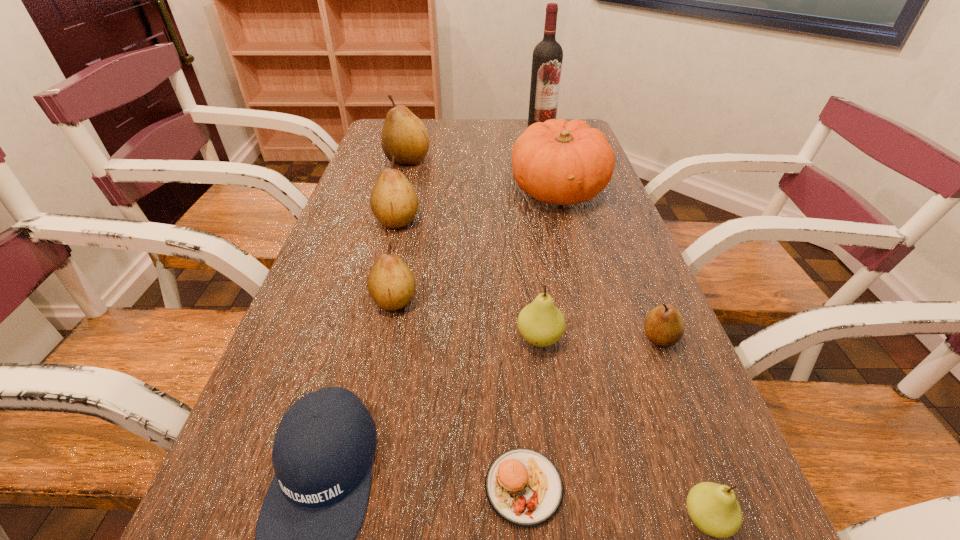
You are a GUI agent. You are given a task and a screenshot of the screen. Output one action in this format:
    pyautogui.click(x=<x>, y=<y>)
    Task: Click on the wine bottle
    
    Given the screenshot: What is the action you would take?
    pyautogui.click(x=547, y=58)

The image size is (960, 540). What are the coordinates of `the farthest object` in the screenshot? It's located at (547, 58).

Where is `the farthest pear`? This screenshot has width=960, height=540. the farthest pear is located at coordinates (403, 135).

Image resolution: width=960 pixels, height=540 pixels. What are the coordinates of `the tallest pear` in the screenshot? It's located at (403, 135).

This screenshot has height=540, width=960. Identify the location of pumpkin. (558, 162).

Locate an element on the screen. the second farthest pear is located at coordinates [x=394, y=202].

Locate an element on the screen. the third smallest brown pear is located at coordinates (394, 202).

You are a GUI agent. You are given a task and a screenshot of the screen. Output one action in this format:
    pyautogui.click(x=<x>, y=<y>)
    Task: Click on the farther green pear
    The height and width of the screenshot is (540, 960).
    Given the screenshot: What is the action you would take?
    pyautogui.click(x=540, y=323)

You are a GUI agent. You are given a task and a screenshot of the screen. Output one action in this format:
    pyautogui.click(x=<x>, y=<y>)
    Task: Click on the left green pear
    
    Given the screenshot: What is the action you would take?
    pyautogui.click(x=540, y=323)

Identify the location of the third biggest brown pear. (391, 284).